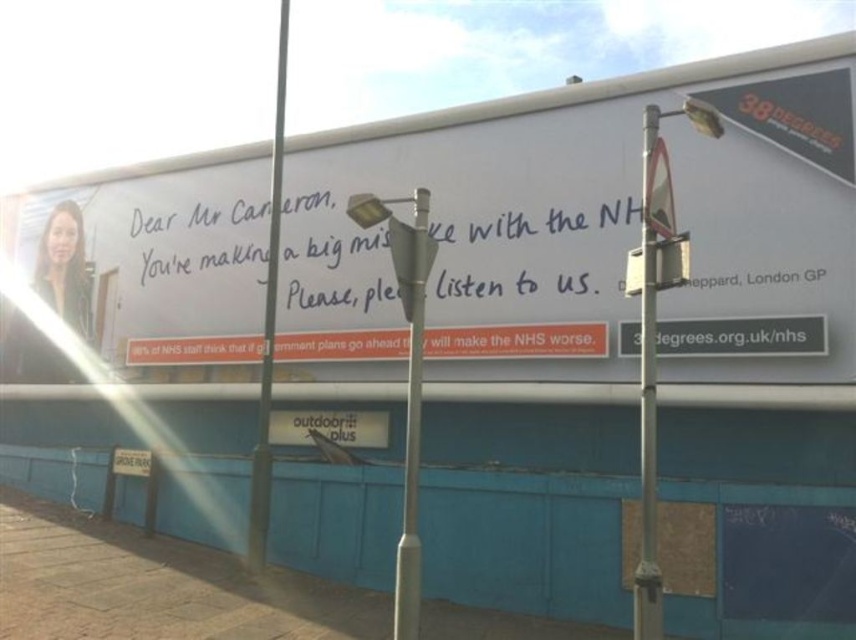
You are a delivery person trying to navigate a narrow alley between the metallic silver pole at right and the metallic pole at center. The delivery cart you are pushing is 2 meters wide. Can you safely pass through the gap between them?

The metallic silver pole at right and metallic pole at center are 23.48 feet apart from each other. Converting feet to meters, 23.48 feet is approximately 7.15 meters. Since the delivery cart is only 2 meters wide, there is more than enough space to safely pass through the gap between the metallic silver pole at right and the metallic pole at center.

You are a photographer standing at the base of the metallic silver pole at right. You want to take a photo of the camera that is 4.09 meters away. What is the minimum distance you need to move forward to ensure the camera fits in your camera frame?

The camera is 4.09 meters away from the metallic silver pole at right. To ensure the camera fits in your camera frame, you need to move forward until the distance between you and the camera is less than or equal to the maximum focusing distance of your camera lens. However, without knowing the specific lens and its focusing capabilities, it is difficult to determine the exact minimum distance required. Generally, most cameras can focus on subjects within a few centimeters to several meters away. If your aim

You are a pedestrian standing on the sidewalk and see the white paper billboard at upper center and the metallic pole at center. Which object is closer to the right edge of the image?

The white paper billboard at upper center is positioned on the right side of the metallic pole at center, meaning it is closer to the right edge of the image.